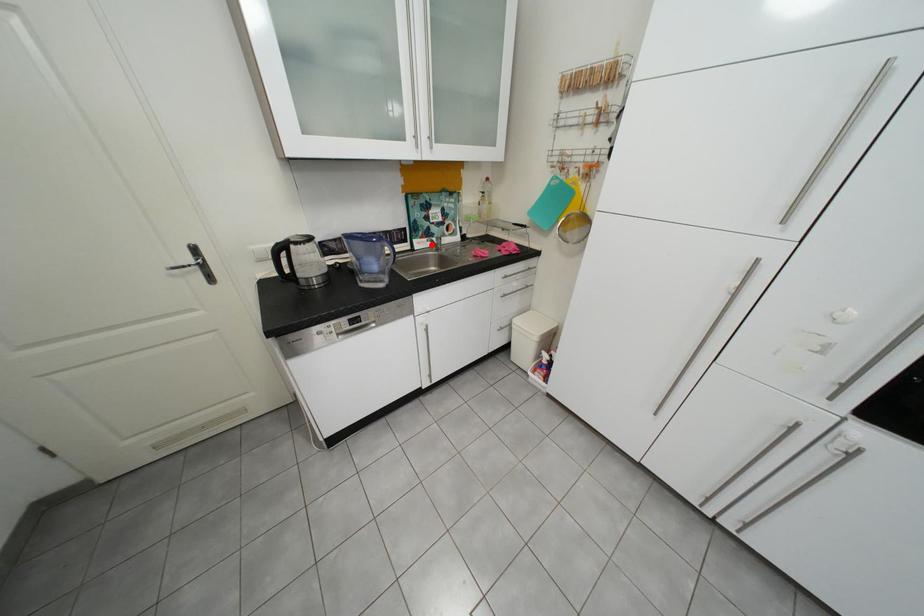
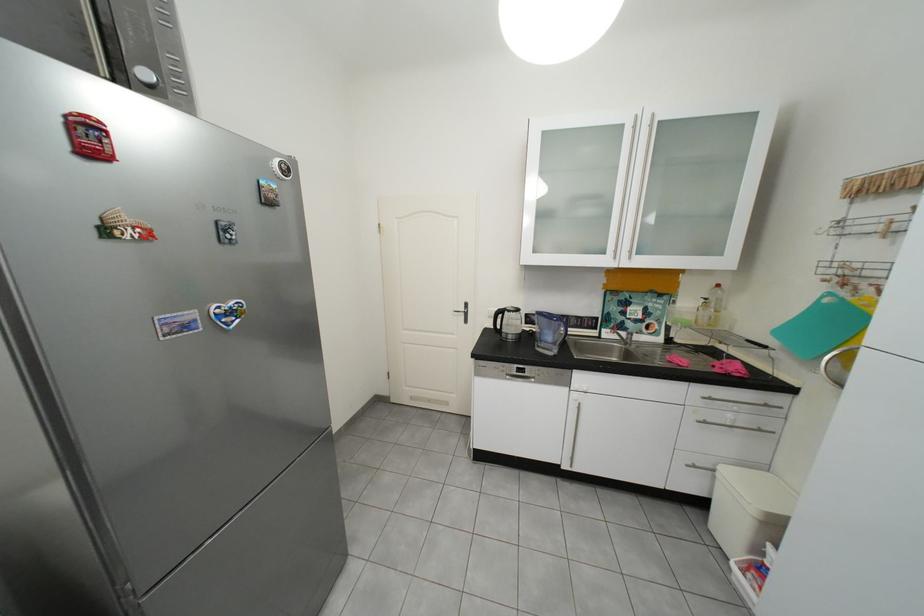
In the second image, find the point that corresponds to the highlighted location in the first image.

(619, 334)